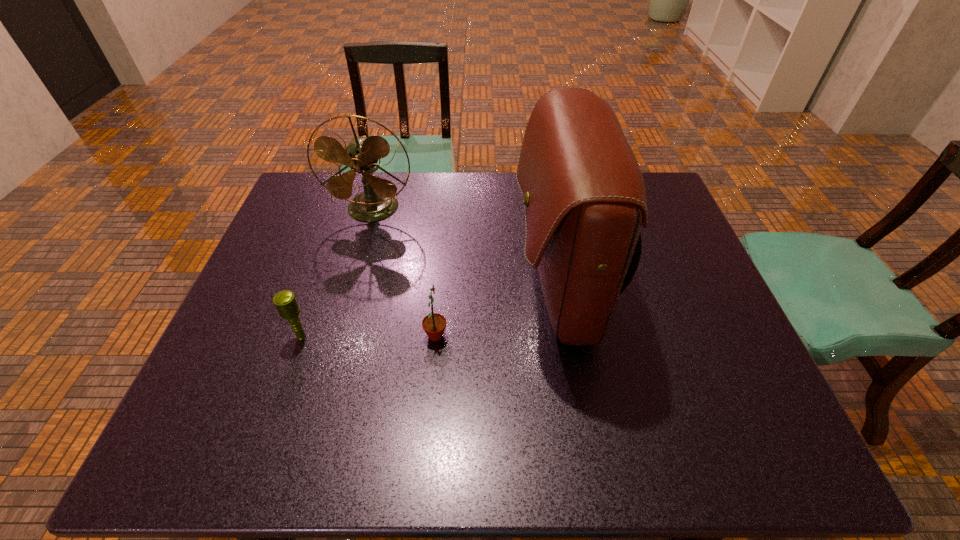
What are the coordinates of `vacant region between the shortest object and the satchel` in the screenshot? It's located at (431, 312).

At what (x,y) coordinates should I click in order to perform the action: click on free area in between the microphone and the third object from left to right. Please return your answer as a coordinate pair (x, y). Looking at the image, I should click on (369, 336).

Identify which object is located as the third nearest to the fan. Please provide its 2D coordinates. Your answer should be formatted as a tuple, i.e. [(x, y)], where the tuple contains the x and y coordinates of a point satisfying the conditions above.

[(285, 301)]

Choose which object is the nearest neighbor to the shortest object. Please provide its 2D coordinates. Your answer should be formatted as a tuple, i.e. [(x, y)], where the tuple contains the x and y coordinates of a point satisfying the conditions above.

[(434, 324)]

This screenshot has width=960, height=540. I want to click on free space that satisfies the following two spatial constraints: 1. on the open flap of the rightmost object; 2. on the front side of the microphone, so click(567, 337).